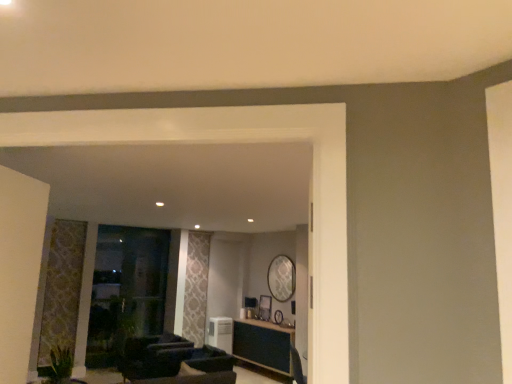
Question: Is point (228, 357) positioned closer to the camera than point (264, 319)?

Choices:
 (A) farther
 (B) closer

Answer: (B)

Question: From their relative heights in the image, would you say dark brown leather armchair at center is taller or shorter than wooden picture frame at center?

Choices:
 (A) tall
 (B) short

Answer: (B)

Question: Which object is the farthest from the metallic silver swivel chair at center?

Choices:
 (A) wooden picture frame at center
 (B) dark brown leather armchair at center
 (C) green leafy plant at lower left
 (D) wooden table at center
 (E) white plastic air conditioner at center

Answer: (C)

Question: Which is farther from the white plastic air conditioner at center?

Choices:
 (A) wooden picture frame at center
 (B) green leafy plant at lower left
 (C) wooden table at center
 (D) transparent glass door at left
 (E) metallic silver swivel chair at center

Answer: (B)